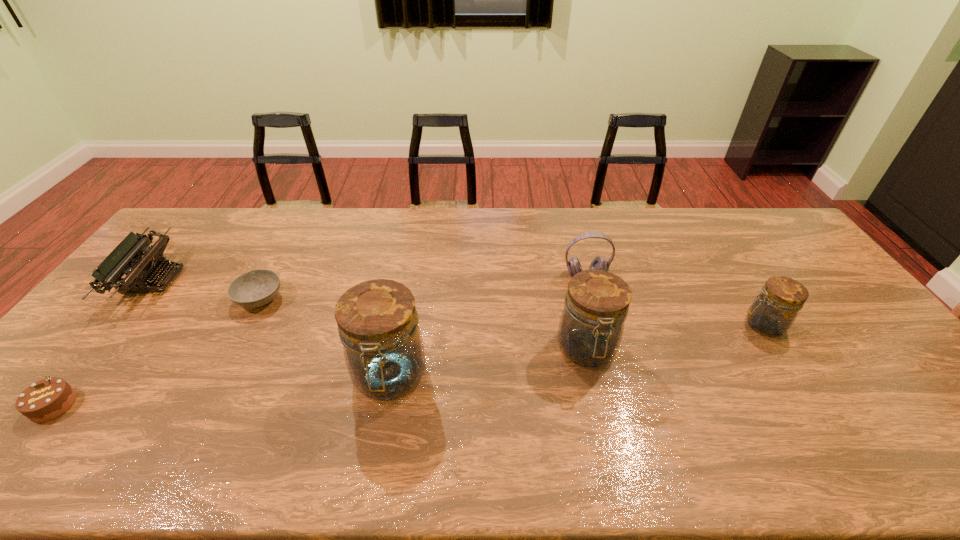
Find the location of a particular element. vacant spot to place a jar on the left is located at coordinates (168, 409).